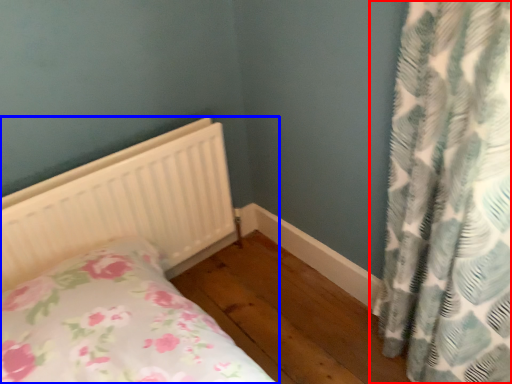
Question: Which point is closer to the camera, curtain (highlighted by a red box) or bed (highlighted by a blue box)?

Choices:
 (A) curtain
 (B) bed

Answer: (A)